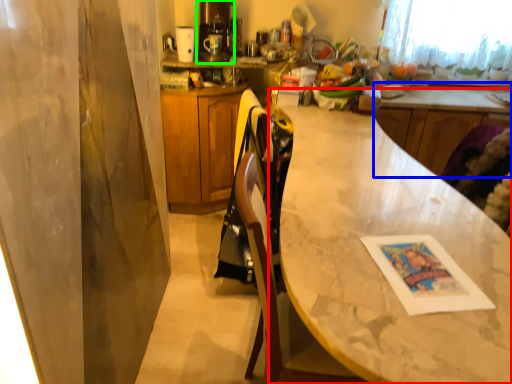
Question: Estimate the real-world distances between objects in this image. Which object is farther from countertop (highlighted by a red box), counter (highlighted by a blue box) or coffee machine (highlighted by a green box)?

Choices:
 (A) counter
 (B) coffee machine

Answer: (B)